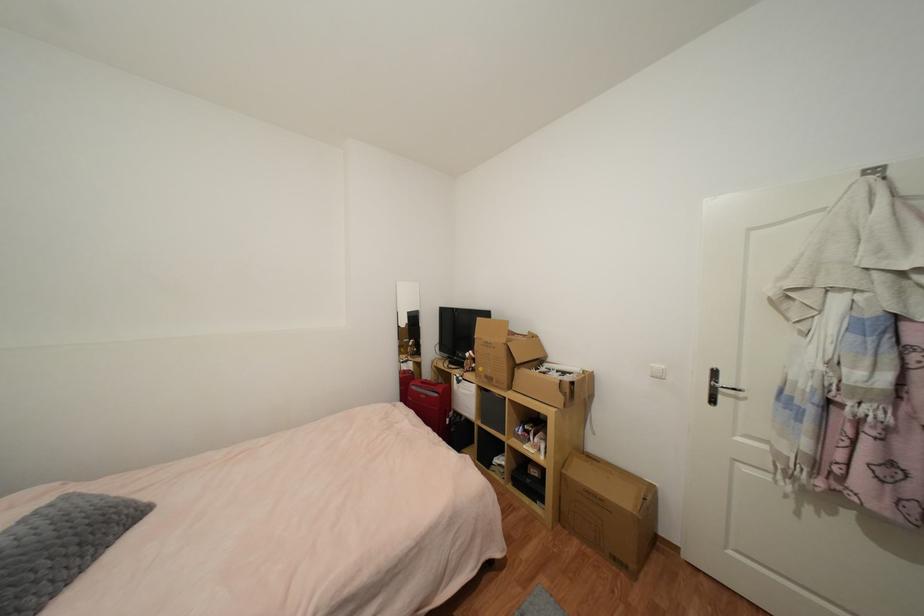
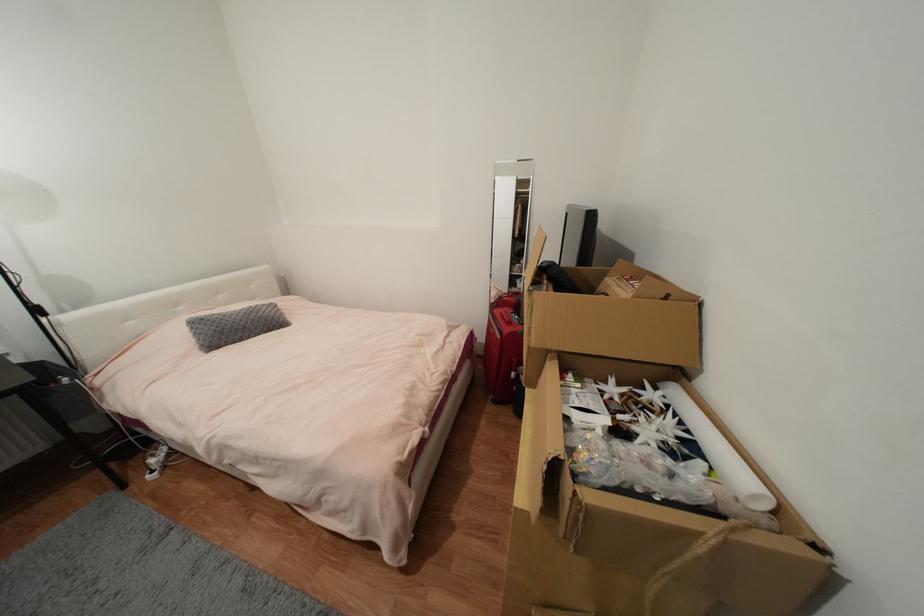
In the second image, find the point that corresponds to [453,421] in the first image.

(517, 375)